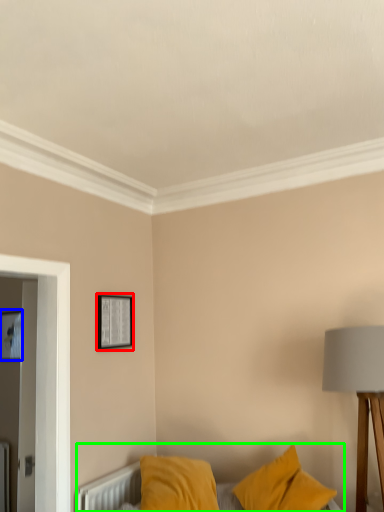
Question: Based on their relative distances, which object is farther from picture frame (highlighted by a red box)? Choose from picture frame (highlighted by a blue box) and bed (highlighted by a green box).

Choices:
 (A) picture frame
 (B) bed

Answer: (A)